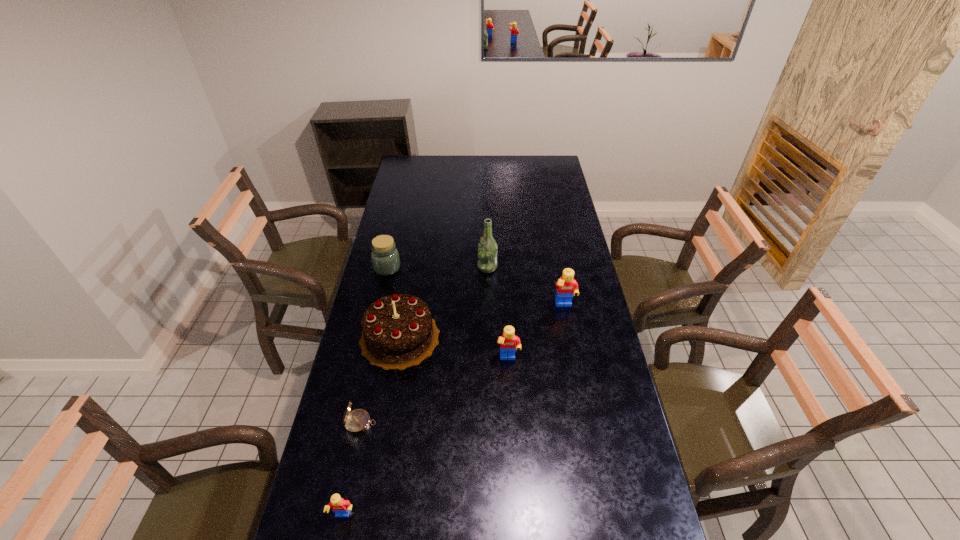
The height and width of the screenshot is (540, 960). Identify the location of vacant area situated on the face of the second Lego from right to left. (516, 488).

At what (x,y) coordinates should I click in order to perform the action: click on vacant space located 0.260m on the face of the rightmost object. Please return your answer as a coordinate pair (x, y). Looking at the image, I should click on (577, 370).

What are the coordinates of `vacant region located on the surface of the beer bottle` in the screenshot? It's located at (419, 267).

This screenshot has height=540, width=960. I want to click on free space located on the surface of the beer bottle, so click(x=402, y=267).

Locate an element on the screen. free location located on the surface of the beer bottle is located at coordinates (437, 267).

At what (x,y) coordinates should I click in order to perform the action: click on free space located 0.120m on the front of the jar. Please return your answer as a coordinate pair (x, y). The width and height of the screenshot is (960, 540). Looking at the image, I should click on (380, 298).

Locate an element on the screen. The height and width of the screenshot is (540, 960). free space located on the front of the birthday cake is located at coordinates (386, 416).

Identify the location of vacant region located 0.260m with the dial facing the second nearest object. The width and height of the screenshot is (960, 540). (461, 423).

This screenshot has width=960, height=540. In order to click on object that is at the near edge in this screenshot , I will do `click(341, 507)`.

Where is `Lego that is at the left edge`? Lego that is at the left edge is located at coordinates (341, 507).